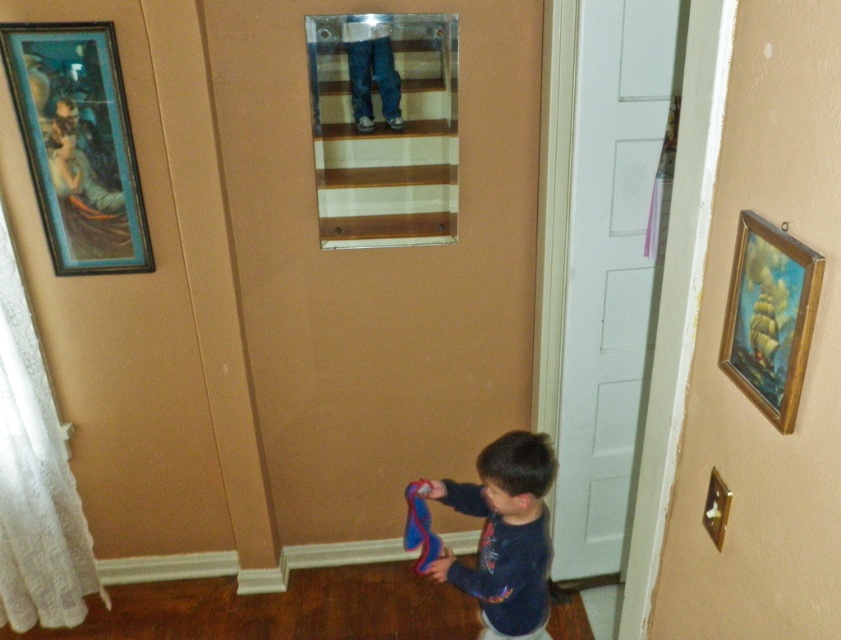
Question: Does matte black painting at upper left have a greater width compared to dark blue sweater at lower right?

Choices:
 (A) no
 (B) yes

Answer: (A)

Question: From the image, what is the correct spatial relationship of dark blue sweater at lower right in relation to gold wooden picture frame at right?

Choices:
 (A) left
 (B) right

Answer: (A)

Question: Which object is the closest to the dark blue sweater at lower right?

Choices:
 (A) shiny blue fabric at lower center
 (B) gold wooden picture frame at right
 (C) matte black painting at upper left

Answer: (A)

Question: Which point appears farthest from the camera in this image?

Choices:
 (A) (543, 625)
 (B) (87, 122)

Answer: (A)

Question: Can you confirm if matte black painting at upper left is positioned to the right of dark blue sweater at lower right?

Choices:
 (A) no
 (B) yes

Answer: (A)

Question: Which point is closer to the camera?

Choices:
 (A) dark blue sweater at lower right
 (B) shiny blue fabric at lower center

Answer: (A)